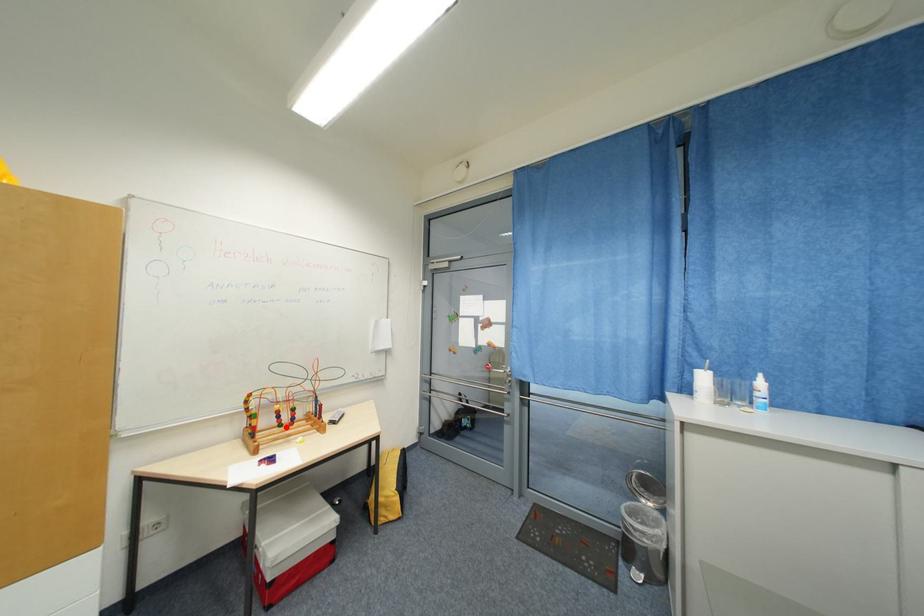
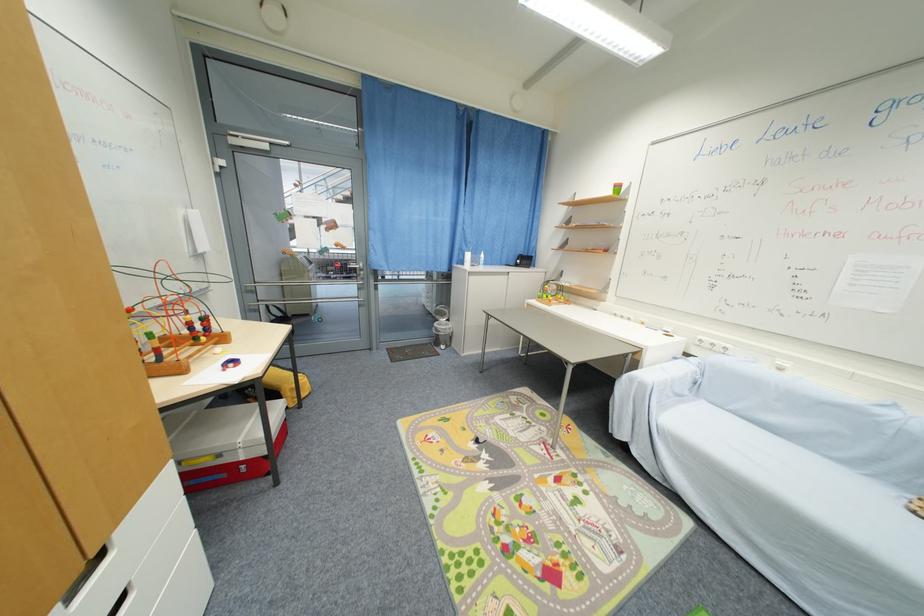
In the second image, find the point that corresponds to the highlighted location in the first image.

(201, 341)